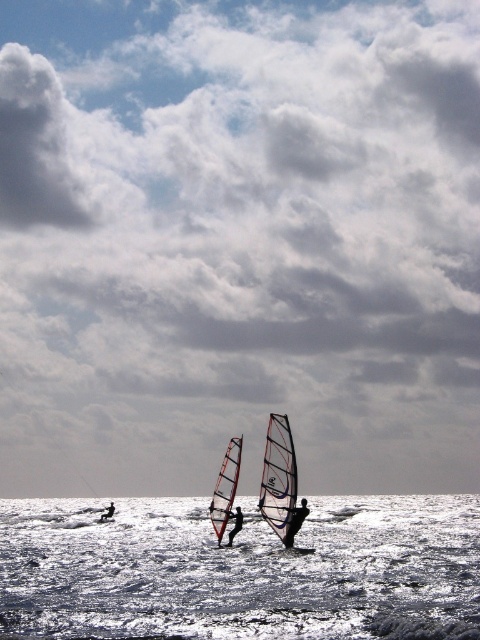
Question: Among these points, which one is nearest to the camera?

Choices:
 (A) (112, 500)
 (B) (292, 532)
 (C) (267, 515)

Answer: (B)

Question: From the image, what is the correct spatial relationship of clear plastic sail at center in relation to dark blue fabric sail at center?

Choices:
 (A) left
 (B) right

Answer: (B)

Question: Which object appears farthest from the camera in this image?

Choices:
 (A) dark blue wetsuit at lower left
 (B) black matte windsurfer at center

Answer: (A)

Question: Is clear plastic sail at center to the left of dark blue fabric sail at center from the viewer's perspective?

Choices:
 (A) no
 (B) yes

Answer: (A)

Question: Estimate the real-world distances between objects in this image. Which object is closer to the dark blue fabric sail at center?

Choices:
 (A) transparent white sail at center
 (B) clear plastic sail at center

Answer: (A)

Question: Does clear plastic sail at center have a smaller size compared to dark blue fabric sail at center?

Choices:
 (A) no
 (B) yes

Answer: (A)